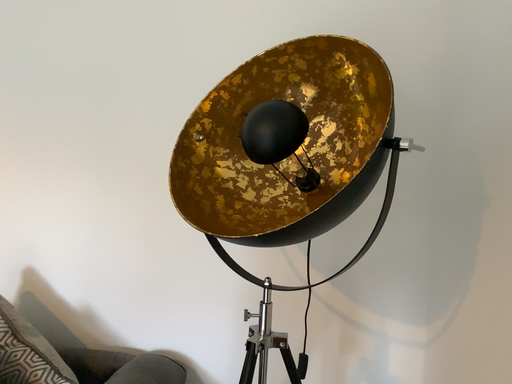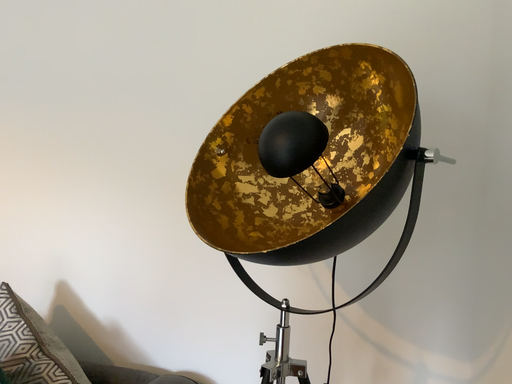
Question: Which way did the camera rotate in the video?

Choices:
 (A) rotated right
 (B) rotated left

Answer: (B)